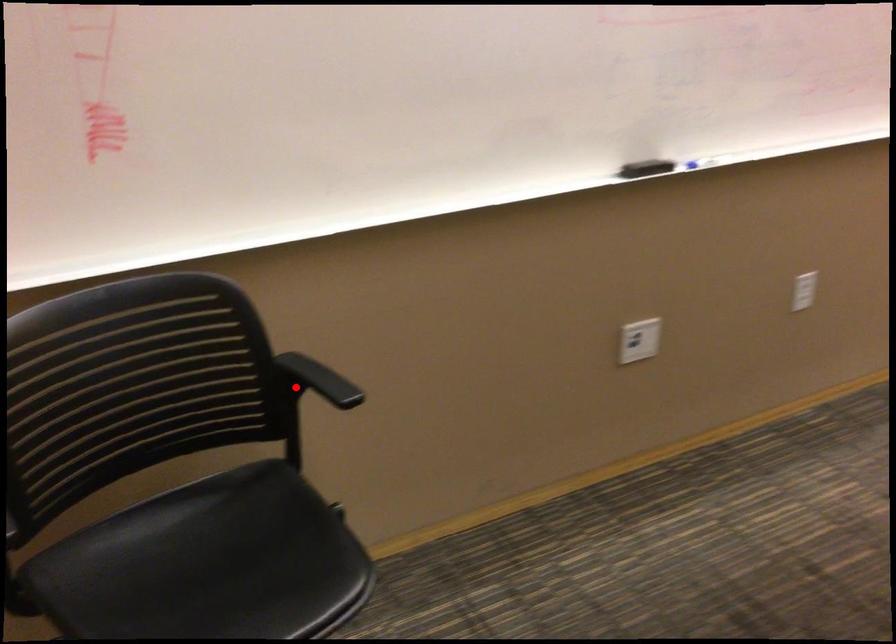
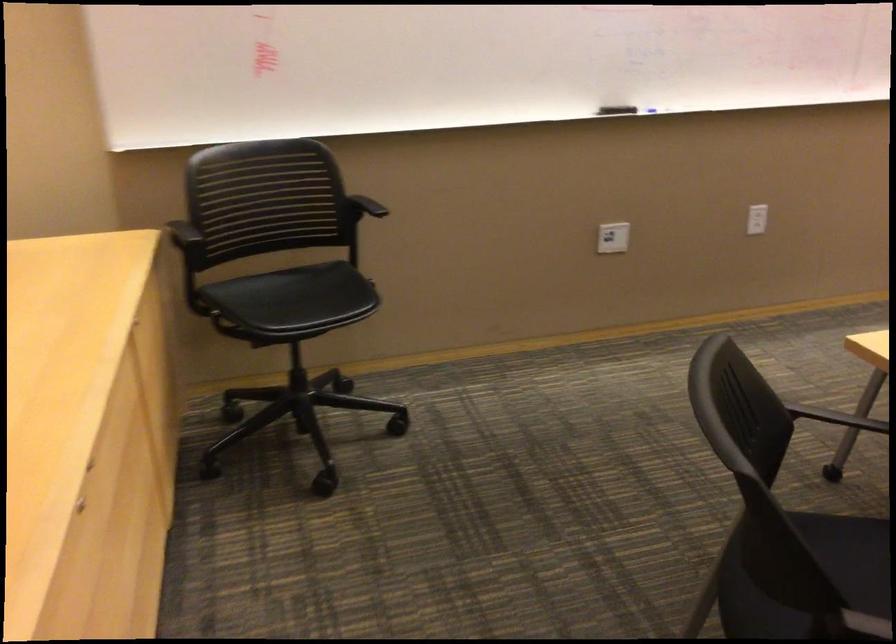
Find the pixel in the second image that matches the highlighted location in the first image.

(366, 205)